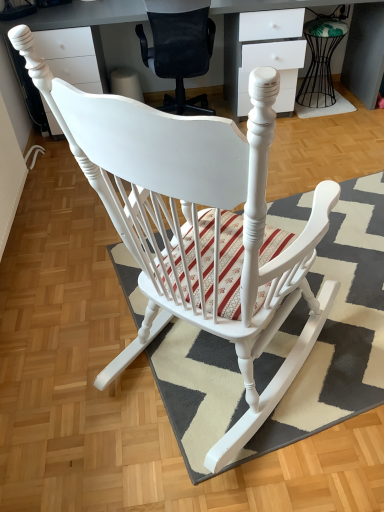
Identify the location of free area behind metallic wire stool at upper right. This screenshot has height=512, width=384. (319, 86).